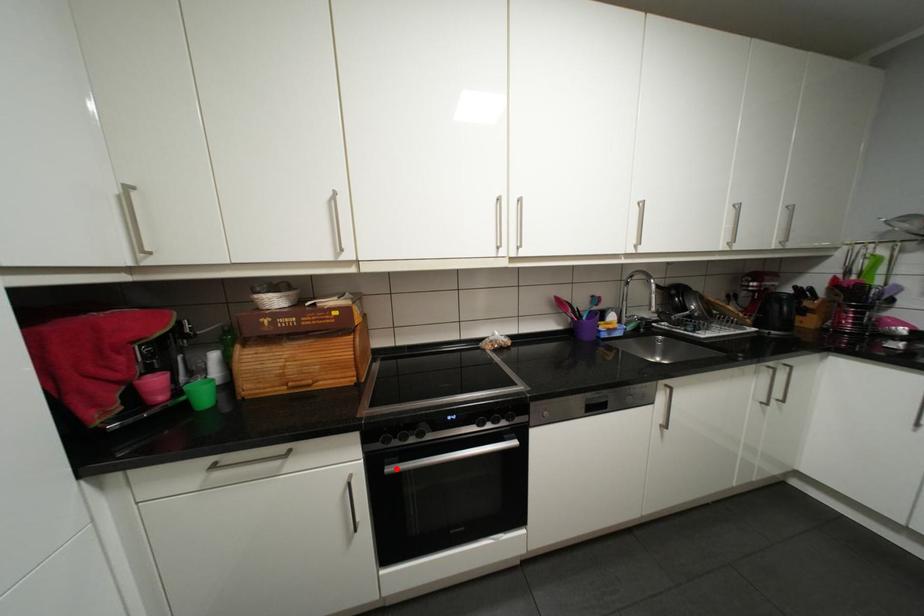
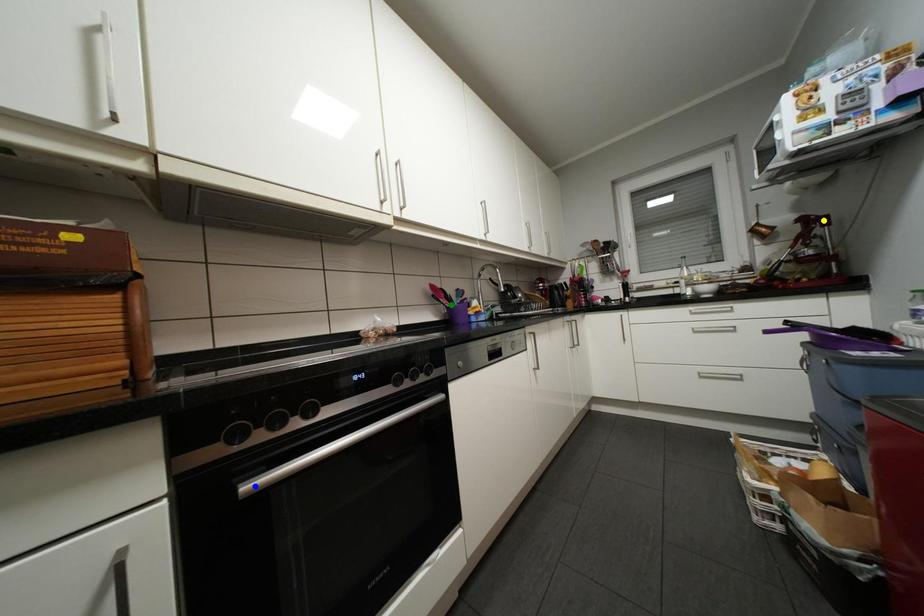
Question: I am providing you with two images of the same scene from different viewpoints. A red point is marked on the first image. You are given multiple points on the second image. In image 2, which mark is for the same physical point as the one in image 1?

Choices:
 (A) blue point
 (B) green point
 (C) yellow point

Answer: (A)